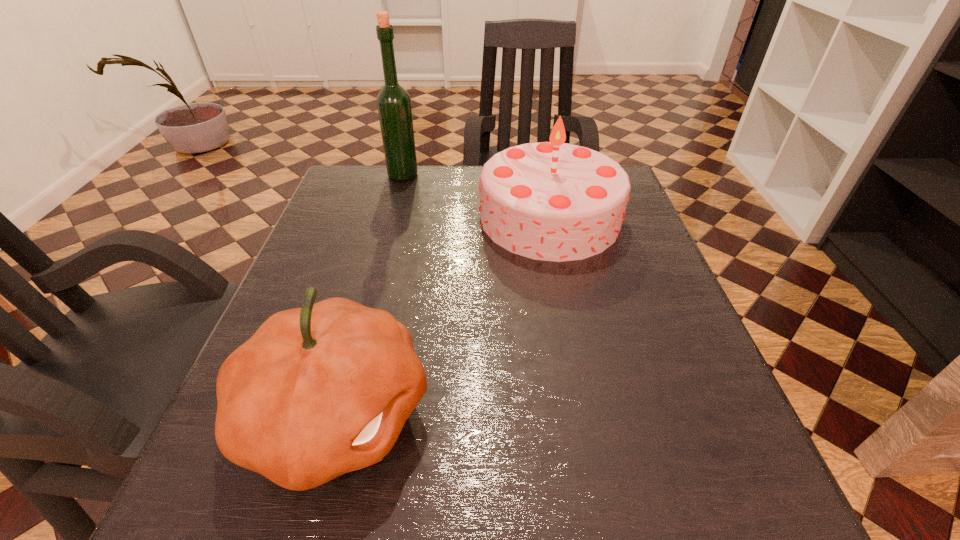
Find the location of `liquor located at the left edge`. liquor located at the left edge is located at coordinates (393, 102).

You are a GUI agent. You are given a task and a screenshot of the screen. Output one action in this format:
    pyautogui.click(x=<x>, y=<y>)
    Task: Click on the pumpkin that is at the left edge
    The image size is (960, 540).
    Given the screenshot: What is the action you would take?
    pyautogui.click(x=318, y=391)

Where is `object that is at the right edge`? object that is at the right edge is located at coordinates (553, 201).

You are a GUI agent. You are given a task and a screenshot of the screen. Output one action in this format:
    pyautogui.click(x=<x>, y=<y>)
    Task: Click on the object present at the far left corner
    
    Given the screenshot: What is the action you would take?
    pyautogui.click(x=393, y=102)

Locate an element on the screen. object that is at the near left corner is located at coordinates (318, 391).

Where is `object at the far right corner`? Image resolution: width=960 pixels, height=540 pixels. object at the far right corner is located at coordinates (553, 201).

This screenshot has width=960, height=540. In the image, there is a desktop. Find the location of `vacant space at the right edge`. vacant space at the right edge is located at coordinates (621, 260).

The image size is (960, 540). In the image, there is a desktop. Find the location of `free space at the far left corner`. free space at the far left corner is located at coordinates (382, 176).

The height and width of the screenshot is (540, 960). In the image, there is a desktop. What are the coordinates of `free region at the near left corner` in the screenshot? It's located at (204, 503).

Where is `vacant area at the near right corner of the desktop`? The height and width of the screenshot is (540, 960). vacant area at the near right corner of the desktop is located at coordinates (753, 489).